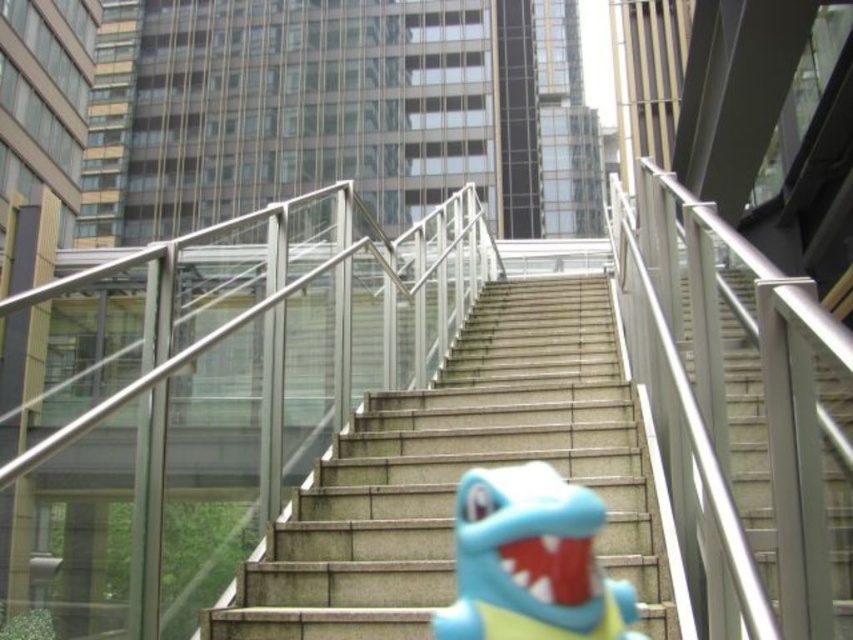
The image size is (853, 640). Find the location of `metallic silver railing at center`. metallic silver railing at center is located at coordinates (724, 406).

Is metallic silver railing at center thinner than blue rubber toy at center?

Indeed, metallic silver railing at center has a lesser width compared to blue rubber toy at center.

Image resolution: width=853 pixels, height=640 pixels. I want to click on metallic silver railing at center, so pyautogui.click(x=724, y=406).

Identify the location of metallic silver railing at center. This screenshot has height=640, width=853. (724, 406).

Can you confirm if blue rubber toy at center is smaller than satin silver stairs at center?

Yes, blue rubber toy at center is smaller than satin silver stairs at center.

Does blue rubber toy at center appear under satin silver stairs at center?

Yes.

Describe the element at coordinates (531, 561) in the screenshot. I see `blue rubber toy at center` at that location.

I want to click on blue rubber toy at center, so click(531, 561).

Is metallic silver railing at center below concrete stairs at center?

No.

Identify the location of metallic silver railing at center. The width and height of the screenshot is (853, 640). (724, 406).